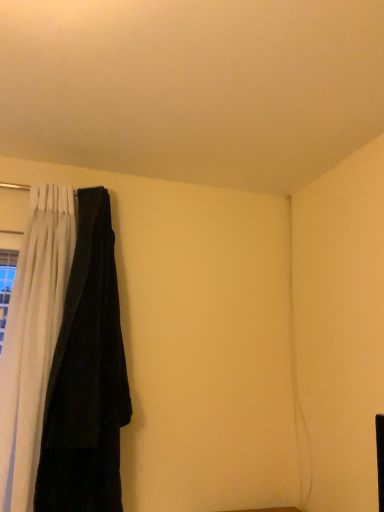
What is the approximate height of white soft fabric at left?

white soft fabric at left is 1.15 meters tall.

Identify the location of white soft fabric at left. (86, 377).

Describe the element at coordinates (86, 377) in the screenshot. This screenshot has height=512, width=384. I see `white soft fabric at left` at that location.

Find the location of a particular element. This screenshot has width=384, height=512. white soft fabric at left is located at coordinates (86, 377).